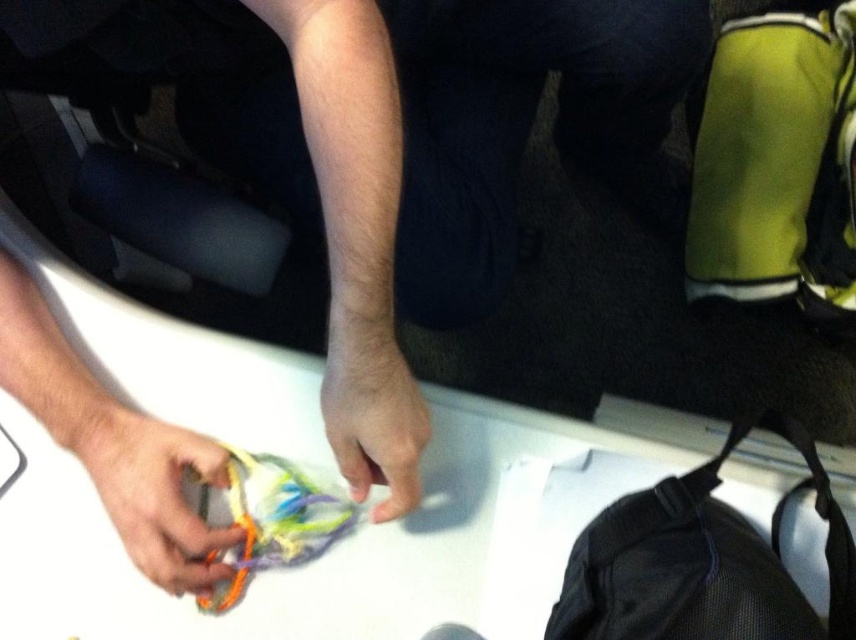
At what (x,y) coordinates should I click in order to perform the action: click on white matte table at center. Please return your answer as a coordinate pair (x, y). The image size is (856, 640). Looking at the image, I should click on pos(304,470).

Is point (434, 481) more distant than point (642, 584)?

That is True.

Which is behind, point (220, 484) or point (699, 545)?

Point (220, 484)

In order to click on white matte table at center in this screenshot , I will do `click(304, 470)`.